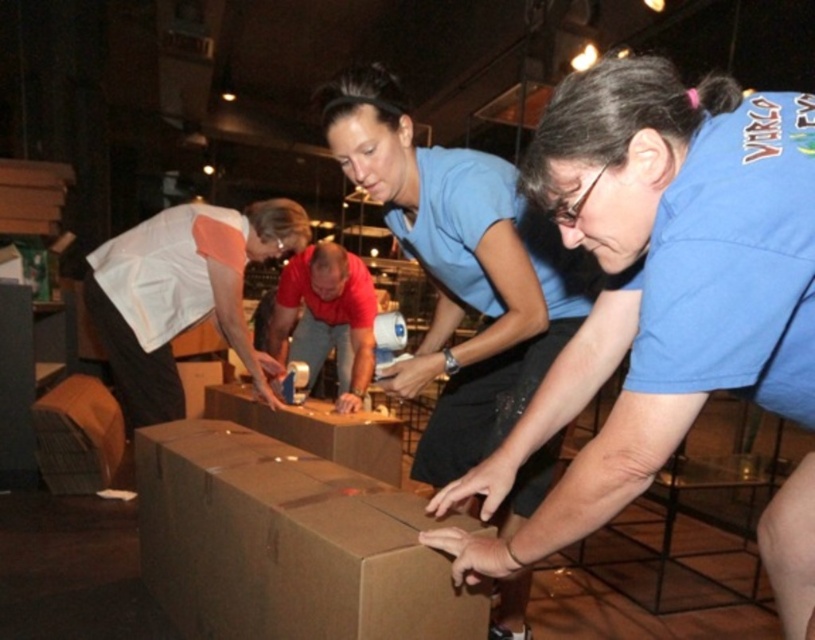
Question: Considering the real-world distances, which object is farthest from the brown cardboard at center?

Choices:
 (A) blue matte shirt at center
 (B) brown cardboard box at center
 (C) red fabric shirt at center
 (D) white matte shirt at upper left

Answer: (A)

Question: Is brown cardboard box at center to the right of red fabric shirt at center from the viewer's perspective?

Choices:
 (A) no
 (B) yes

Answer: (A)

Question: Can you confirm if brown cardboard box at center is positioned to the left of blue matte shirt at center?

Choices:
 (A) yes
 (B) no

Answer: (A)

Question: Based on their relative distances, which object is nearer to the red fabric shirt at center?

Choices:
 (A) white matte shirt at upper left
 (B) brown cardboard at center
 (C) brown cardboard box at center

Answer: (B)

Question: Considering the real-world distances, which object is farthest from the blue matte shirt at center?

Choices:
 (A) white matte shirt at upper left
 (B) red fabric shirt at center

Answer: (A)

Question: Does blue matte shirt at center have a larger size compared to red fabric shirt at center?

Choices:
 (A) yes
 (B) no

Answer: (B)